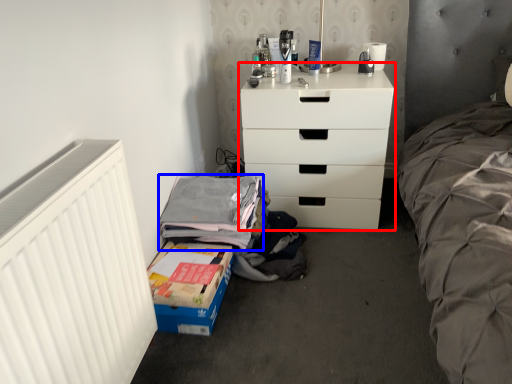
Question: Which object appears closest to the camera in this image, chest of drawers (highlighted by a red box) or clothing (highlighted by a blue box)?

Choices:
 (A) chest of drawers
 (B) clothing

Answer: (B)